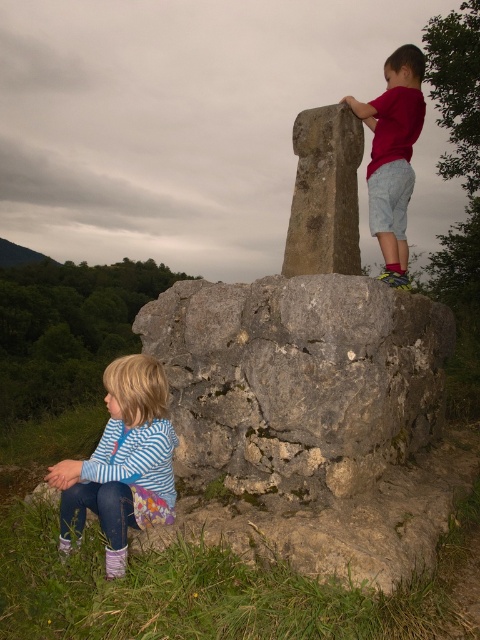
Question: Which point is farther to the camera?

Choices:
 (A) red cotton shirt at upper right
 (B) gray rough rock at center

Answer: (A)

Question: Among these objects, which one is nearest to the camera?

Choices:
 (A) striped fabric shirt at lower left
 (B) gray rough rock at center
 (C) red cotton shirt at upper right

Answer: (A)

Question: In this image, where is gray rough rock at center located relative to striped fabric shirt at lower left?

Choices:
 (A) right
 (B) left

Answer: (A)

Question: Does gray rough rock at center come behind red cotton shirt at upper right?

Choices:
 (A) yes
 (B) no

Answer: (B)

Question: Which point is farther from the camera taking this photo?

Choices:
 (A) (144, 404)
 (B) (380, 196)

Answer: (B)

Question: Can you confirm if gray rough rock at center is positioned below red cotton shirt at upper right?

Choices:
 (A) no
 (B) yes

Answer: (B)